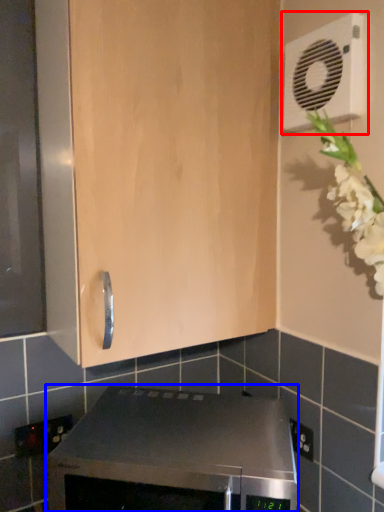
Question: Which of the following is the farthest to the observer, air conditioning (highlighted by a red box) or home appliance (highlighted by a blue box)?

Choices:
 (A) air conditioning
 (B) home appliance

Answer: (A)